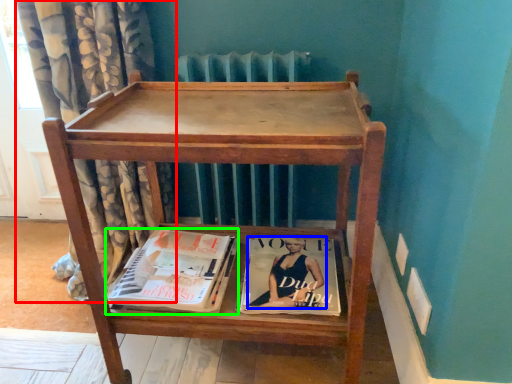
Question: Considering the real-world distances, which object is farthest from curtain (highlighted by a red box)? person (highlighted by a blue box) or book (highlighted by a green box)?

Choices:
 (A) person
 (B) book

Answer: (A)